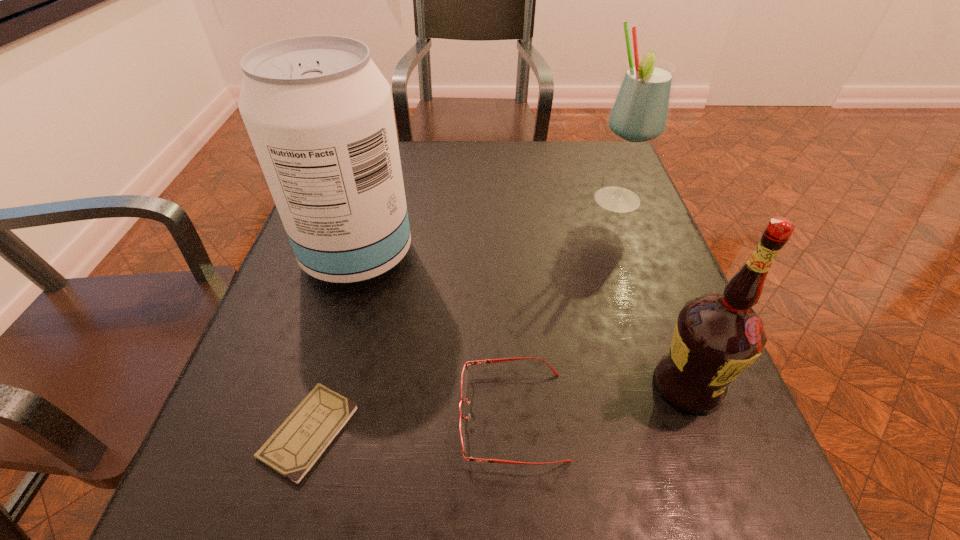
Identify the location of vacant area situated 0.130m on the label of the third tallest object. (734, 508).

Locate an element on the screen. This screenshot has width=960, height=540. free space located on the lenses of the third object from right to left is located at coordinates (246, 415).

What are the coordinates of `vacant space located on the lenses of the third object from right to left` in the screenshot? It's located at tap(395, 415).

In order to click on vacant space located 0.340m on the lenses of the third object from right to left in this screenshot , I will do `click(239, 415)`.

At what (x,y) coordinates should I click in order to perform the action: click on free location located on the right of the shortest object. Please return your answer as a coordinate pair (x, y). The image size is (960, 540). Looking at the image, I should click on (480, 431).

Find the location of a particular element. object at the far edge is located at coordinates click(640, 111).

Image resolution: width=960 pixels, height=540 pixels. What are the coordinates of `spectacles that is at the near edge` in the screenshot? It's located at (464, 376).

Locate an element on the screen. This screenshot has height=540, width=960. checkbook that is at the near edge is located at coordinates (292, 450).

You are a GUI agent. You are given a task and a screenshot of the screen. Output one action in this format:
    pyautogui.click(x=<x>, y=<y>)
    Task: Click on the alcohol at the left edge
    
    Given the screenshot: What is the action you would take?
    pyautogui.click(x=319, y=113)

You are a GUI agent. You are given a task and a screenshot of the screen. Output one action in this format:
    pyautogui.click(x=<x>, y=<y>)
    Task: Click on the checkbook that is at the left edge
    
    Given the screenshot: What is the action you would take?
    pyautogui.click(x=292, y=450)